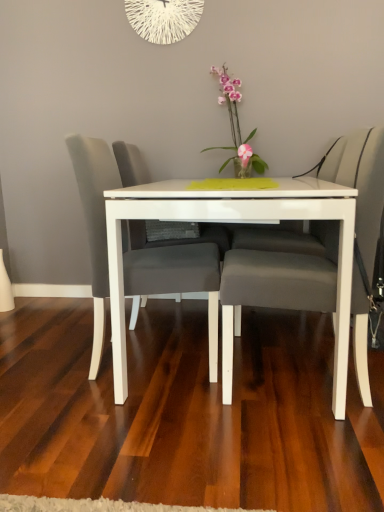
Where is `vacant space positioned to the left of matte gray chair at center, the first chair positioned from the left`? This screenshot has width=384, height=512. vacant space positioned to the left of matte gray chair at center, the first chair positioned from the left is located at coordinates (49, 360).